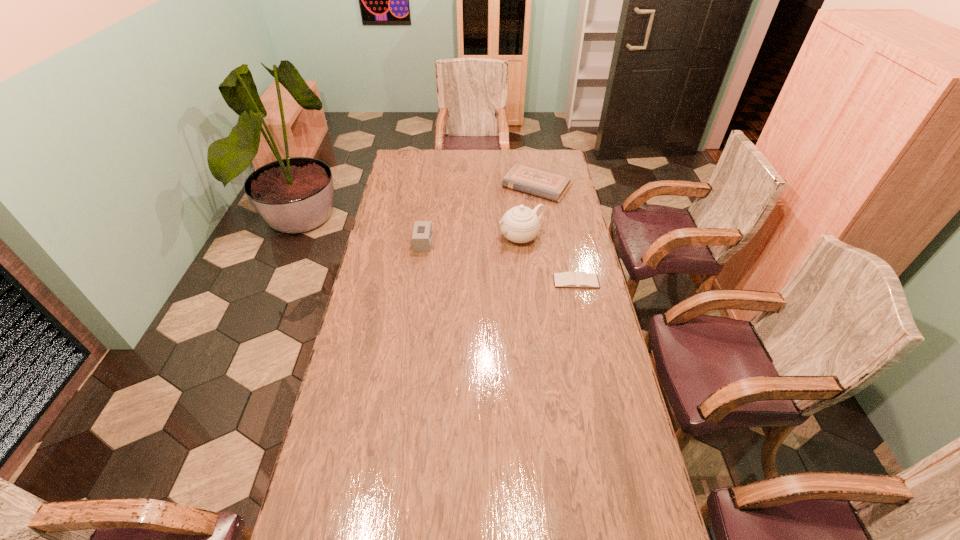
The height and width of the screenshot is (540, 960). I want to click on vacant space that satisfies the following two spatial constraints: 1. on the front side of the chinaware; 2. on the right side of the nearest object, so click(525, 281).